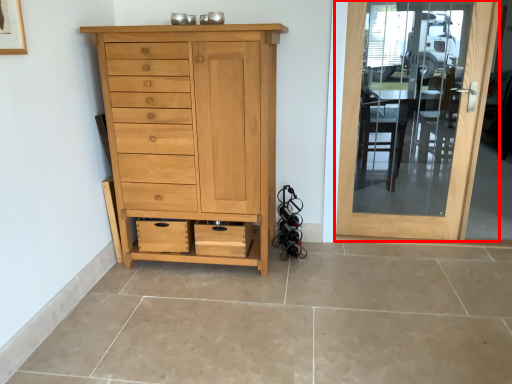
Question: Where is door (annotated by the red box) located in relation to chest of drawers in the image?

Choices:
 (A) right
 (B) left

Answer: (A)